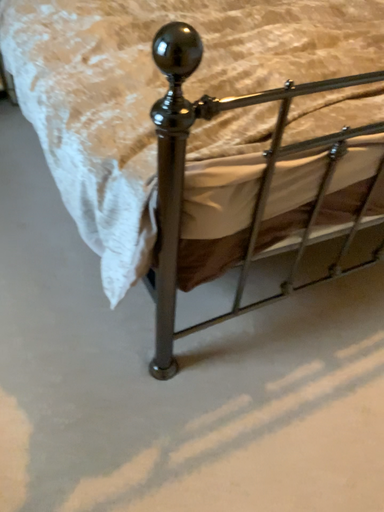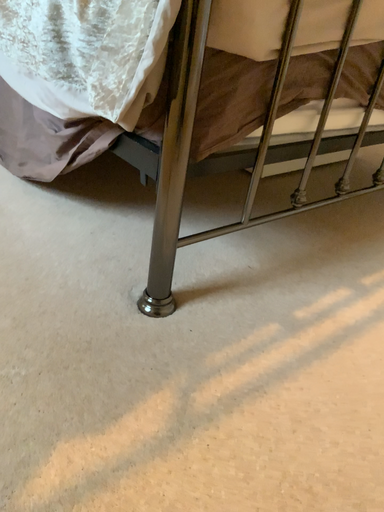
Question: How did the camera likely rotate when shooting the video?

Choices:
 (A) rotated downward
 (B) rotated upward

Answer: (B)